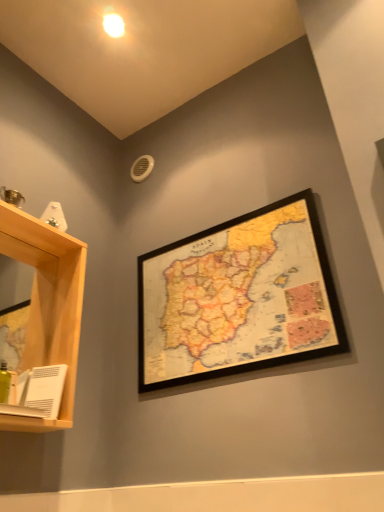
Question: From the image's perspective, is white matte book at lower left positioned above or below light wood shelf at left?

Choices:
 (A) below
 (B) above

Answer: (A)

Question: Considering the positions of white matte book at lower left and light wood shelf at left in the image, is white matte book at lower left wider or thinner than light wood shelf at left?

Choices:
 (A) wide
 (B) thin

Answer: (B)

Question: Considering the real-world distances, which object is closest to the light wood shelf at left?

Choices:
 (A) white glossy light bulb at upper center
 (B) wooden framed map at upper center
 (C) white matte book at lower left

Answer: (C)

Question: Based on their relative distances, which object is nearer to the light wood shelf at left?

Choices:
 (A) white matte book at lower left
 (B) wooden framed map at upper center
 (C) white glossy light bulb at upper center

Answer: (A)